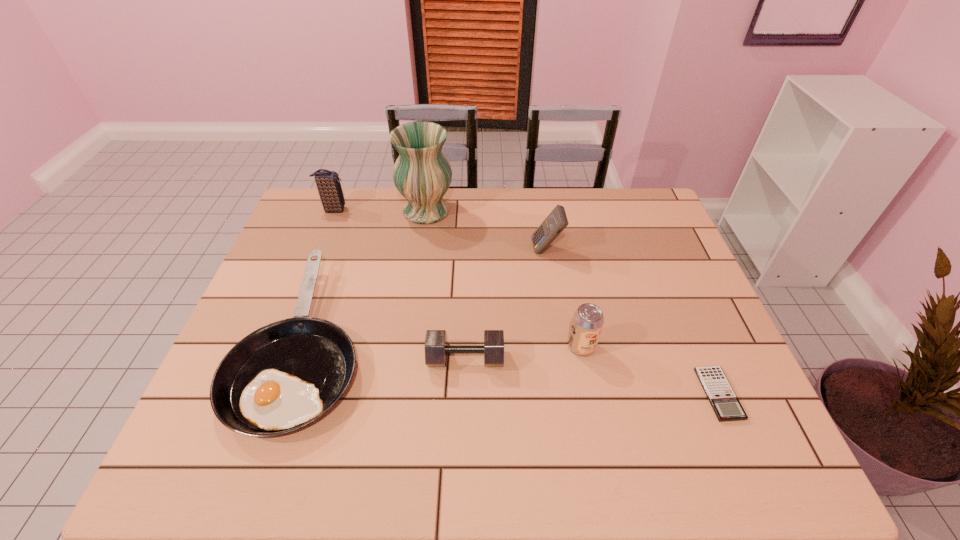
The image size is (960, 540). Identify the location of vacant point located with the zip open on the clutch bag. (462, 210).

Identify the location of free space located 0.300m on the front-facing side of the third farthest object. The height and width of the screenshot is (540, 960). (435, 249).

Locate an element on the screen. free space located 0.170m on the front-facing side of the third farthest object is located at coordinates (477, 249).

Image resolution: width=960 pixels, height=540 pixels. I want to click on vacant region located 0.160m on the front-facing side of the third farthest object, so click(480, 249).

At what (x,y) coordinates should I click in order to perform the action: click on vacant space located on the back of the fourth shortest object. Please return your answer as a coordinate pair (x, y). Looking at the image, I should click on (564, 254).

Identify the location of free location located 0.340m on the left of the third shortest object. The image size is (960, 540). (289, 359).

Find the location of a particular element. The width and height of the screenshot is (960, 540). vacant area situated on the back of the second shortest object is located at coordinates (336, 251).

You are a GUI agent. You are given a task and a screenshot of the screen. Output one action in this format:
    pyautogui.click(x=<x>, y=<y>)
    Task: Click on the vacant region located 0.220m on the left of the right calculator
    The height and width of the screenshot is (540, 960).
    Given the screenshot: What is the action you would take?
    pyautogui.click(x=607, y=394)

This screenshot has height=540, width=960. In order to click on vase present at the far edge in this screenshot , I will do `click(422, 174)`.

This screenshot has height=540, width=960. Find the location of `clutch bag at the far edge`. clutch bag at the far edge is located at coordinates (329, 188).